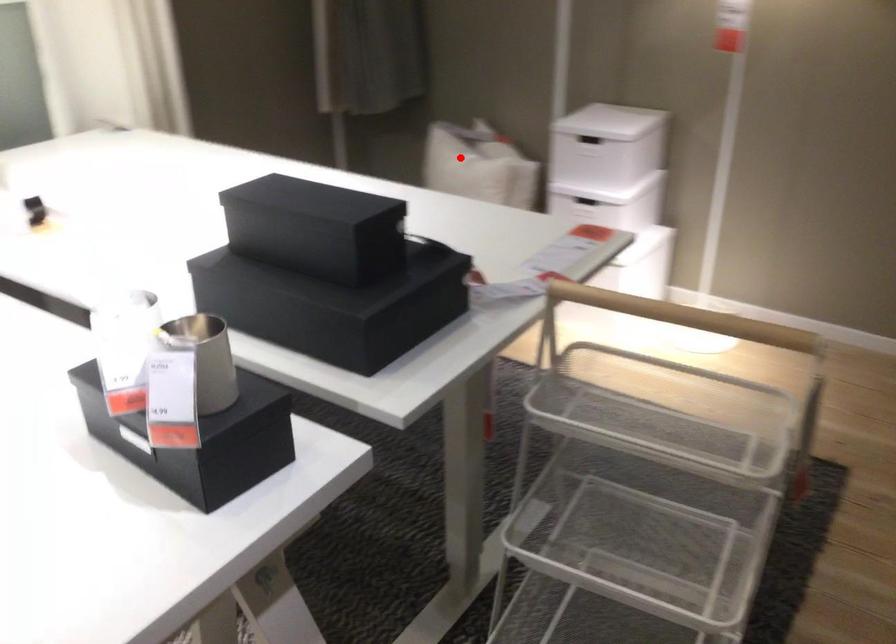
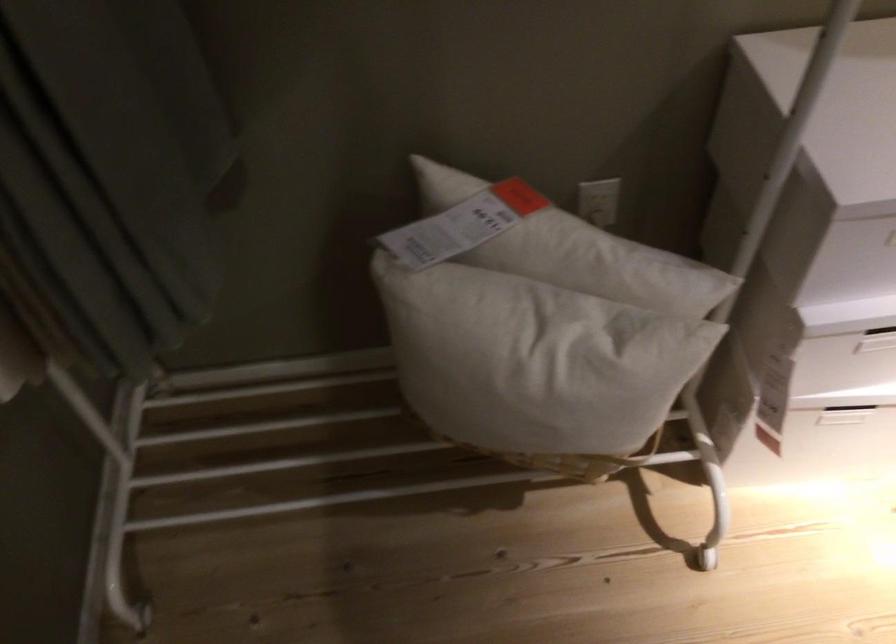
Question: I am providing you with two images of the same scene from different viewpoints. Given a red point in image1, look at the same physical point in image2. Is it:

Choices:
 (A) Closer to the viewpoint
 (B) Farther from the viewpoint

Answer: (A)